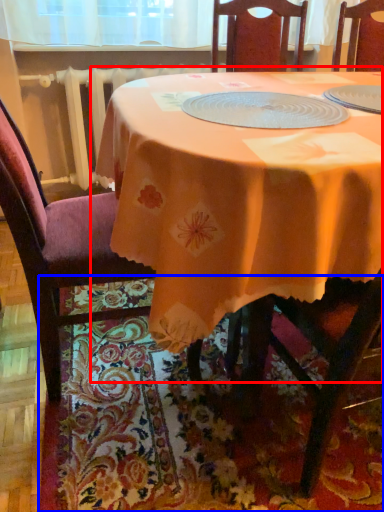
Question: Which object appears closest to the camera in this image, table (highlighted by a red box) or place mat (highlighted by a blue box)?

Choices:
 (A) table
 (B) place mat

Answer: (A)